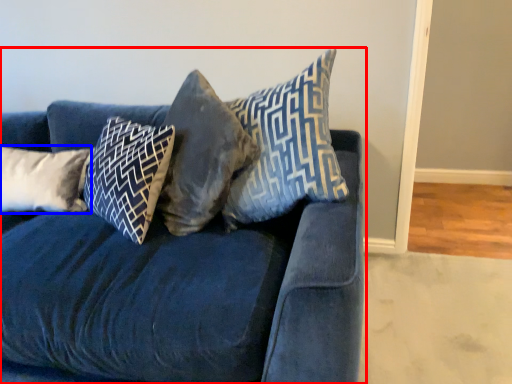
Question: Among these objects, which one is nearest to the camera, studio couch (highlighted by a red box) or pillow (highlighted by a blue box)?

Choices:
 (A) studio couch
 (B) pillow

Answer: (A)